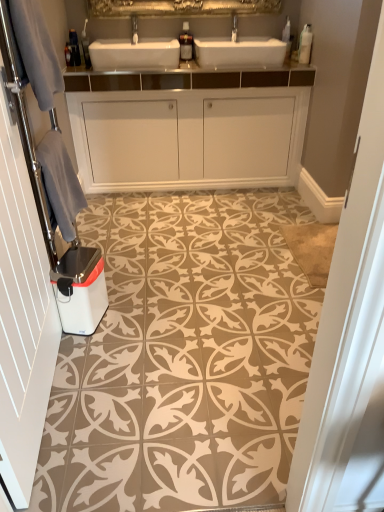
Question: Can you confirm if white glossy dishwasher at lower left is taller than gray fabric towel at left?

Choices:
 (A) no
 (B) yes

Answer: (A)

Question: Is white glossy dishwasher at lower left positioned before gray fabric towel at left?

Choices:
 (A) no
 (B) yes

Answer: (A)

Question: From the image's perspective, is white glossy dishwasher at lower left over gray fabric towel at left?

Choices:
 (A) no
 (B) yes

Answer: (A)

Question: Is white glossy dishwasher at lower left facing away from gray fabric towel at left?

Choices:
 (A) no
 (B) yes

Answer: (A)

Question: Does white glossy dishwasher at lower left appear on the left side of gray fabric towel at left?

Choices:
 (A) no
 (B) yes

Answer: (A)

Question: In the image, is white textured towel at left positioned in front of or behind brown textured tile at center?

Choices:
 (A) front
 (B) behind

Answer: (A)

Question: Is white textured towel at left taller or shorter than brown textured tile at center?

Choices:
 (A) tall
 (B) short

Answer: (A)

Question: From a real-world perspective, is white textured towel at left positioned above or below brown textured tile at center?

Choices:
 (A) above
 (B) below

Answer: (A)

Question: From the image's perspective, relative to brown textured tile at center, is white textured towel at left above or below?

Choices:
 (A) below
 (B) above

Answer: (B)

Question: Considering the positions of brown textured tile at center and white glossy cabinet at center in the image, is brown textured tile at center taller or shorter than white glossy cabinet at center?

Choices:
 (A) tall
 (B) short

Answer: (B)

Question: From the image's perspective, is brown textured tile at center located above or below white glossy cabinet at center?

Choices:
 (A) above
 (B) below

Answer: (B)

Question: Considering the positions of brown textured tile at center and white glossy cabinet at center in the image, is brown textured tile at center wider or thinner than white glossy cabinet at center?

Choices:
 (A) thin
 (B) wide

Answer: (B)

Question: In the image, is brown textured tile at center on the left side or the right side of white glossy cabinet at center?

Choices:
 (A) left
 (B) right

Answer: (B)

Question: Looking at their shapes, would you say white glossy dishwasher at lower left is wider or thinner than white textured towel at left?

Choices:
 (A) wide
 (B) thin

Answer: (A)

Question: From a real-world perspective, is white glossy dishwasher at lower left positioned above or below white textured towel at left?

Choices:
 (A) above
 (B) below

Answer: (B)